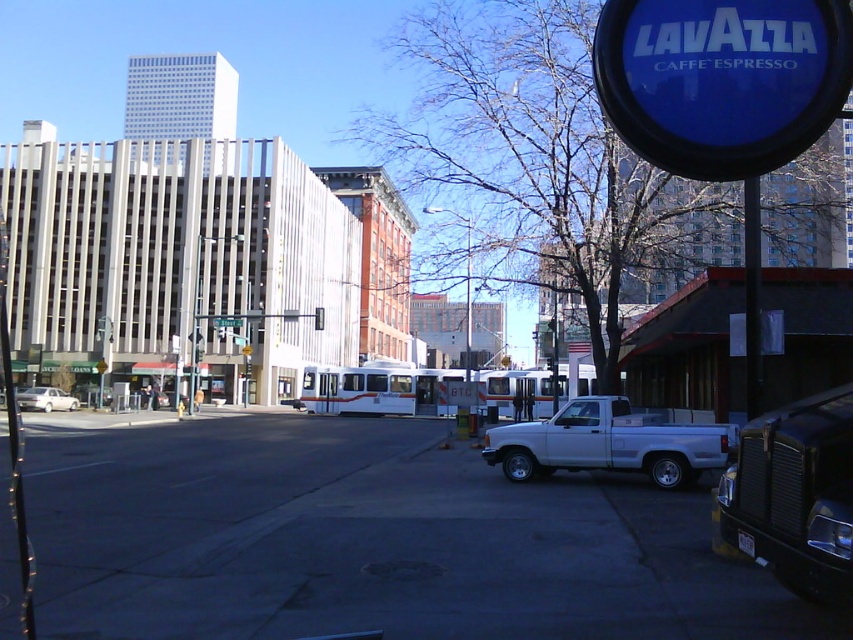
Question: Which point is farther from the camera taking this photo?

Choices:
 (A) (828, 529)
 (B) (756, 291)
 (C) (47, 412)

Answer: (C)

Question: Does gray concrete pavement at center have a lesser width compared to black matte truck at lower right?

Choices:
 (A) no
 (B) yes

Answer: (A)

Question: Which of these objects is positioned closest to the white matte sedan at left?

Choices:
 (A) black matte truck at lower right
 (B) white matte truck at lower right
 (C) gray concrete pavement at center

Answer: (C)

Question: Does white matte truck at lower right have a lesser width compared to green plastic street sign at upper center?

Choices:
 (A) yes
 (B) no

Answer: (B)

Question: Does black matte truck at lower right appear under green plastic street sign at upper center?

Choices:
 (A) no
 (B) yes

Answer: (B)

Question: Estimate the real-world distances between objects in this image. Which object is farther from the white matte truck at lower right?

Choices:
 (A) black matte truck at lower right
 (B) white matte sedan at left
 (C) green plastic street sign at upper center

Answer: (B)